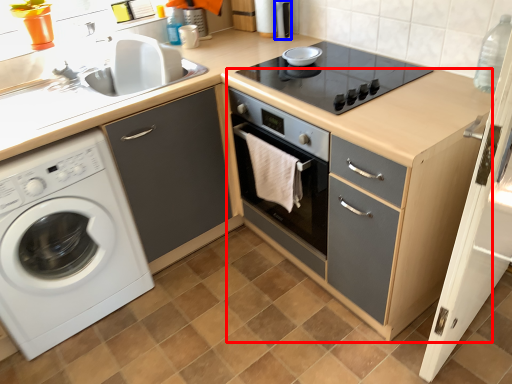
Question: Which of the following is the closest to the observer, file cabinet (highlighted by a red box) or appliance (highlighted by a blue box)?

Choices:
 (A) file cabinet
 (B) appliance

Answer: (A)